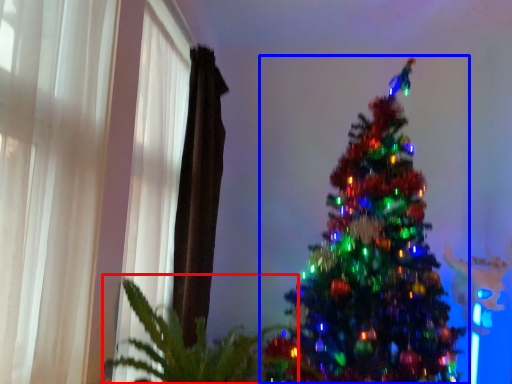
Question: Which point is closer to the camera, plant (highlighted by a red box) or christmas tree (highlighted by a blue box)?

Choices:
 (A) plant
 (B) christmas tree

Answer: (A)